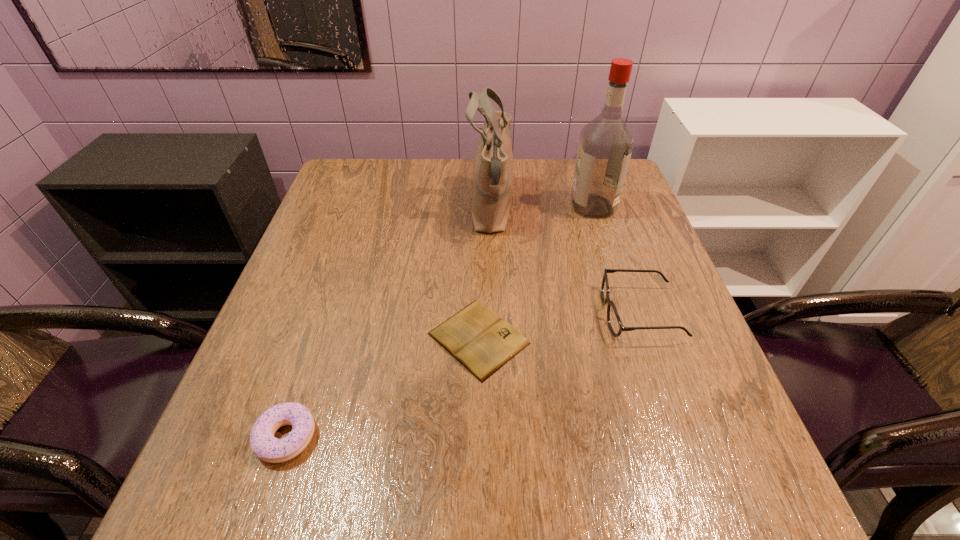
At what (x,y) coordinates should I click in order to perform the action: click on liquor situated at the right edge. Please return your answer as a coordinate pair (x, y). Looking at the image, I should click on (605, 146).

Find the location of a particular element. spectacles positioned at the right edge is located at coordinates (616, 327).

This screenshot has height=540, width=960. Identify the location of object located at the far right corner. (605, 146).

This screenshot has height=540, width=960. In order to click on vacant space at the far edge in this screenshot , I will do `click(432, 178)`.

Find the location of a particular element. The height and width of the screenshot is (540, 960). vacant space at the near edge of the desktop is located at coordinates (443, 519).

Locate an element on the screen. free location at the left edge of the desktop is located at coordinates (309, 264).

I want to click on vacant space at the right edge of the desktop, so click(x=653, y=315).

Where is `vacant area at the near left corner of the desktop`? The width and height of the screenshot is (960, 540). vacant area at the near left corner of the desktop is located at coordinates (294, 478).

This screenshot has width=960, height=540. I want to click on free spot between the tallest object and the third shortest object, so click(x=616, y=260).

I want to click on free space between the shoulder bag and the spectacles, so click(565, 262).